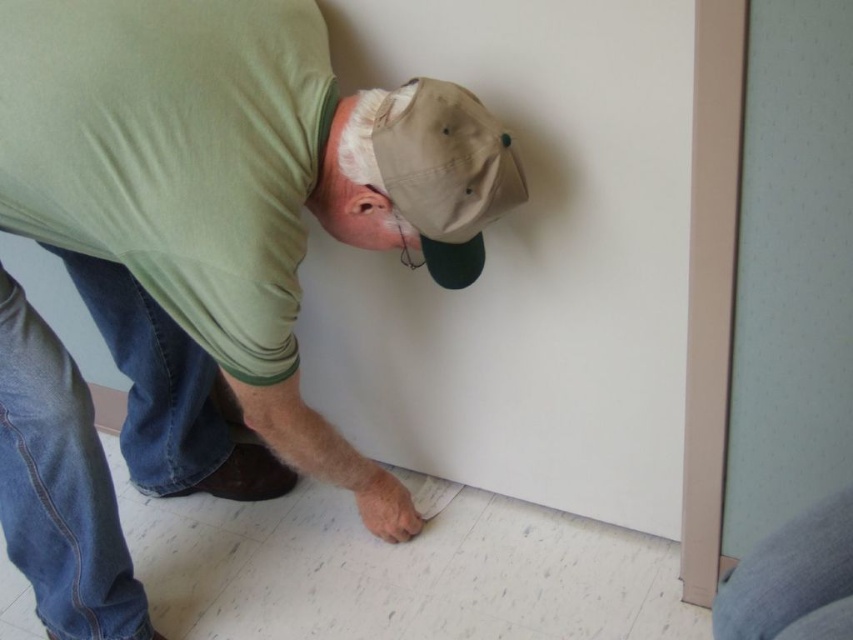
Does point (476, 276) come closer to viewer compared to point (785, 616)?

No, (476, 276) is further to viewer.

Between point (491, 188) and point (834, 547), which one is positioned behind?

Positioned behind is point (491, 188).

Is point (416, 195) positioned in front of point (773, 600)?

No.

The height and width of the screenshot is (640, 853). Identify the location of tan fabric baseball cap at upper center. (445, 172).

Measure the distance from green matte shirt at center to tan fabric baseball cap at upper center.

A distance of 23.25 centimeters exists between green matte shirt at center and tan fabric baseball cap at upper center.

Locate an element on the screen. green matte shirt at center is located at coordinates (228, 214).

Where is `green matte shirt at center`? This screenshot has width=853, height=640. green matte shirt at center is located at coordinates (228, 214).

Where is `green matte shirt at center`? green matte shirt at center is located at coordinates (228, 214).

Is point (119, 273) positioned before point (779, 529)?

No, (119, 273) is behind (779, 529).

The width and height of the screenshot is (853, 640). Find the location of `green matte shirt at center`. green matte shirt at center is located at coordinates (228, 214).